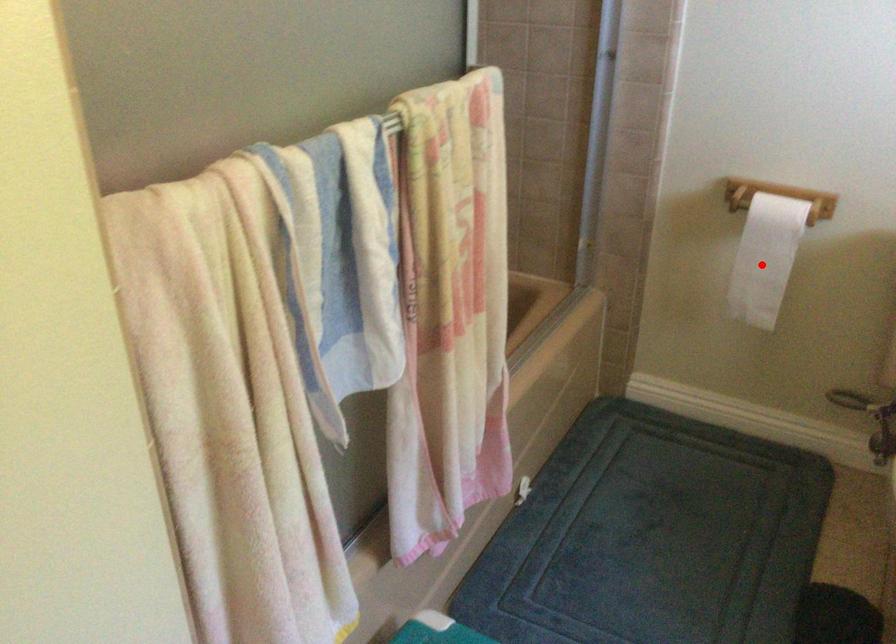
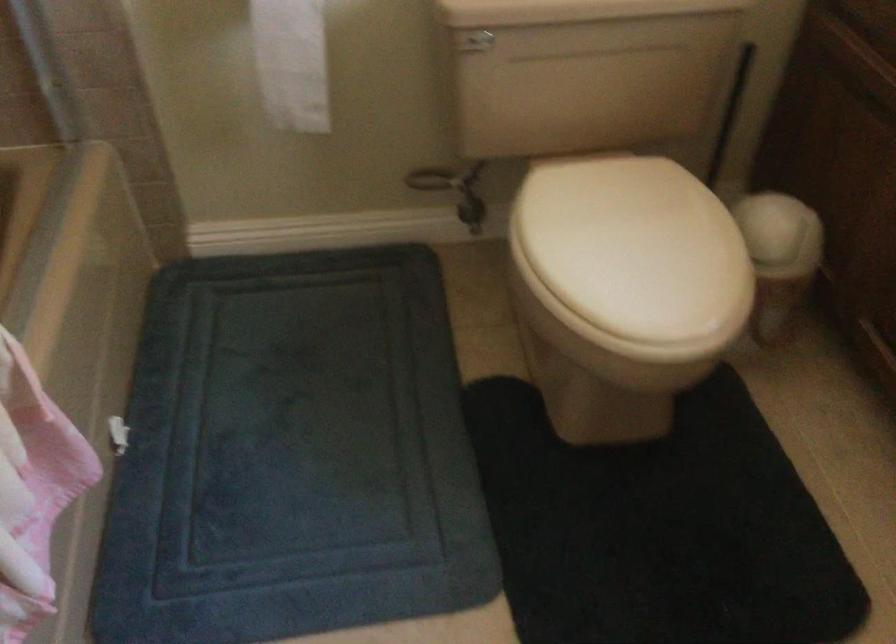
The point at the highlighted location is marked in the first image. Where is the corresponding point in the second image?

(291, 62)